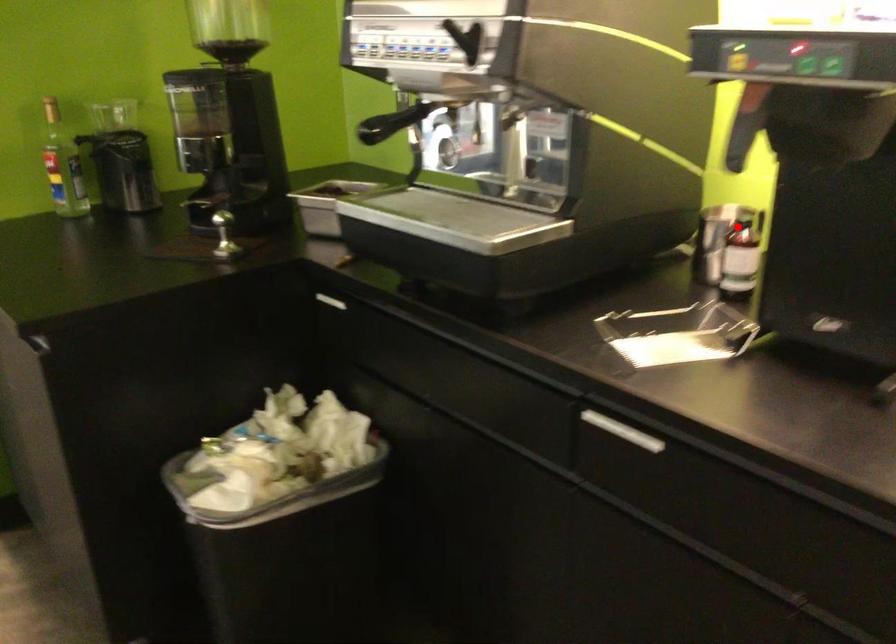
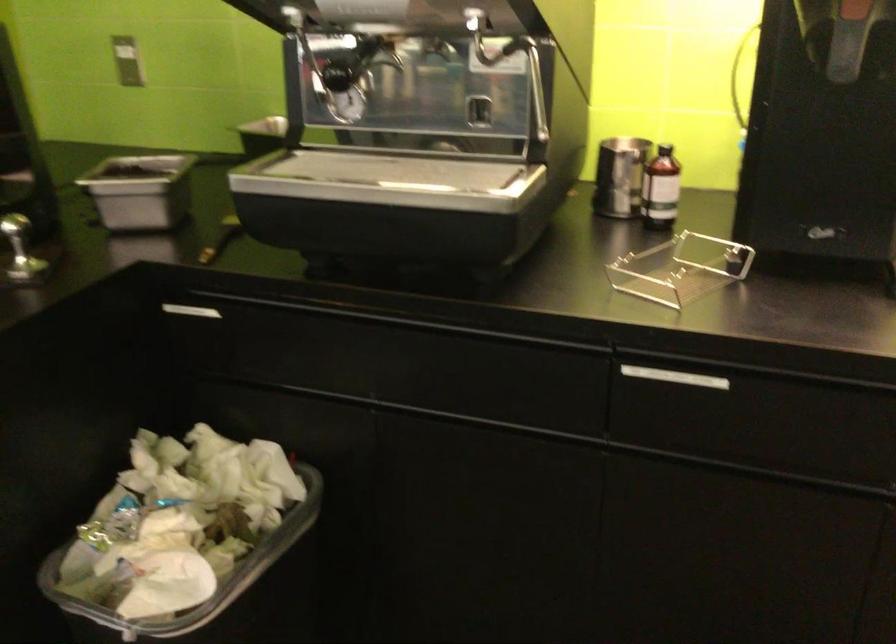
Question: I am providing you with two images of the same scene from different viewpoints. A red point is marked on the first image. Is the red point's position out of view in image 2?

Choices:
 (A) Yes
 (B) No

Answer: (B)